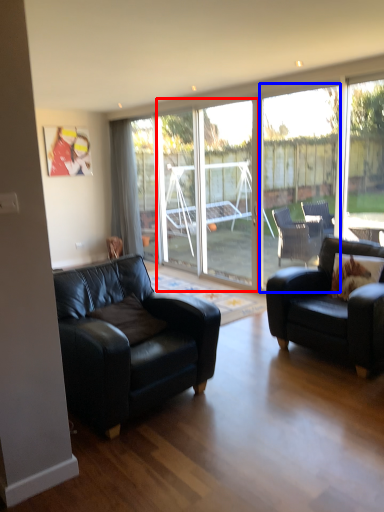
Question: Which object is closer to the camera taking this photo, screen door (highlighted by a red box) or window (highlighted by a blue box)?

Choices:
 (A) screen door
 (B) window

Answer: (B)